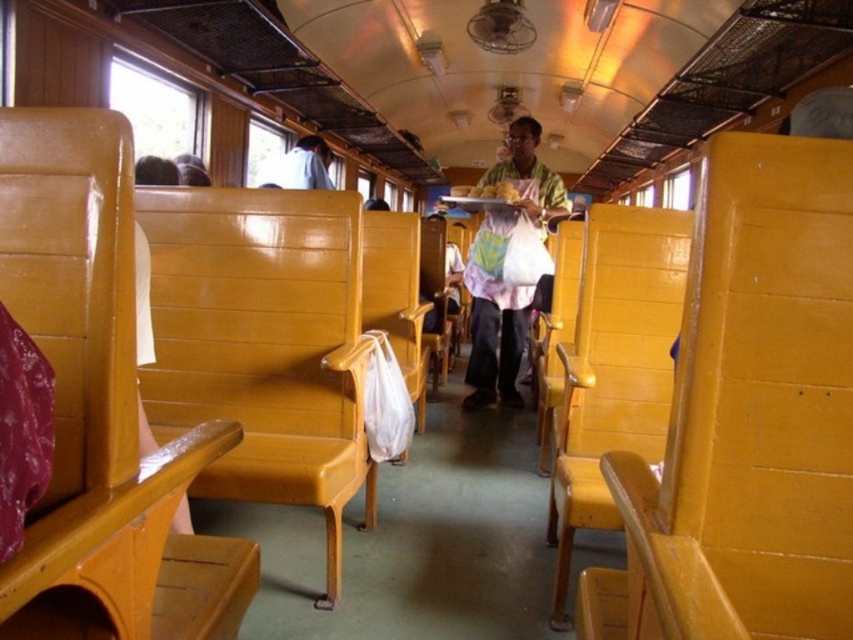
Question: Does matte wood chair at left have a smaller size compared to matte green shirt at center?

Choices:
 (A) yes
 (B) no

Answer: (A)

Question: Does matte wood chair at center have a smaller size compared to yellow wood chair at right?

Choices:
 (A) yes
 (B) no

Answer: (A)

Question: Estimate the real-world distances between objects in this image. Which object is closer to the matte wood chair at left?

Choices:
 (A) yellow wood chair at right
 (B) matte green shirt at center
 (C) matte wood chair at center

Answer: (C)

Question: Which of the following is the closest to the observer?

Choices:
 (A) matte wood chair at center
 (B) white fabric bag at center
 (C) matte green shirt at center

Answer: (A)

Question: Is matte wood chair at left wider than matte green shirt at center?

Choices:
 (A) yes
 (B) no

Answer: (B)

Question: Among these objects, which one is nearest to the camera?

Choices:
 (A) yellow wood chair at right
 (B) matte wood chair at center
 (C) white fabric bag at center
 (D) matte wood chair at left

Answer: (D)